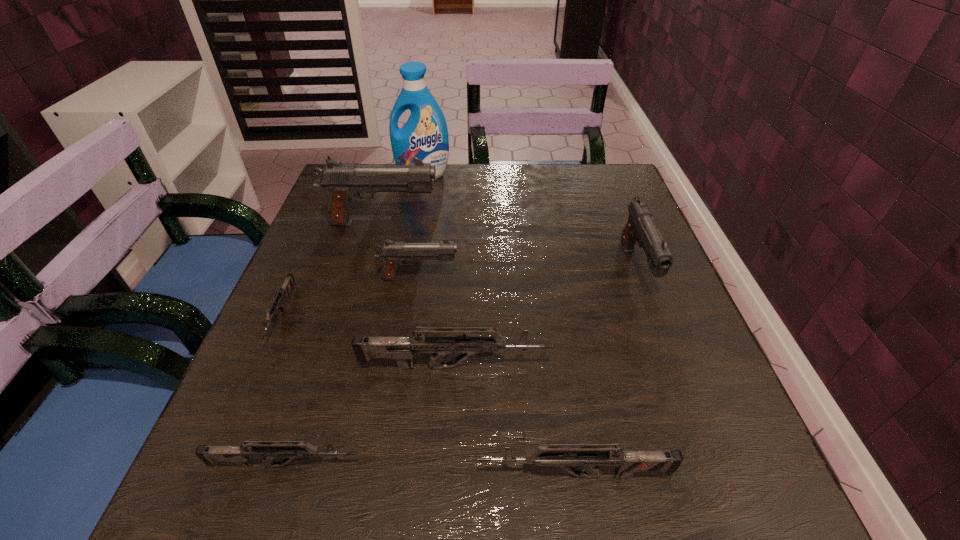
At what (x,y) coordinates should I click in order to perform the action: click on the third shortest object. Please return your answer as a coordinate pair (x, y). Image resolution: width=960 pixels, height=540 pixels. Looking at the image, I should click on (564, 457).

I want to click on the seventh tallest object, so click(268, 450).

Find the location of a particular element. The width and height of the screenshot is (960, 540). the second shortest gun is located at coordinates (268, 450).

You are a GUI agent. You are given a task and a screenshot of the screen. Output one action in this format:
    pyautogui.click(x=<x>, y=<y>)
    Task: Click on the shortest object
    This screenshot has width=960, height=540.
    Given the screenshot: What is the action you would take?
    pyautogui.click(x=283, y=292)

What are the coordinates of `the shortest gun` in the screenshot? It's located at (283, 292).

Find the location of a particular element. vacant space located 0.250m on the front-facing side of the detergent is located at coordinates (411, 240).

Image resolution: width=960 pixels, height=540 pixels. I want to click on blank space located in the direction the seventh nearest object is aimed, so click(514, 223).

I want to click on vacant position located 0.090m in the direction the rightmost gray gun is aimed, so click(x=664, y=343).

The image size is (960, 540). I want to click on free spot located 0.360m in the direction the smallest gray gun is aimed, so click(632, 278).

What are the coordinates of `vacant space located aimed along the barrel of the biggest grey gun` in the screenshot? It's located at (654, 367).